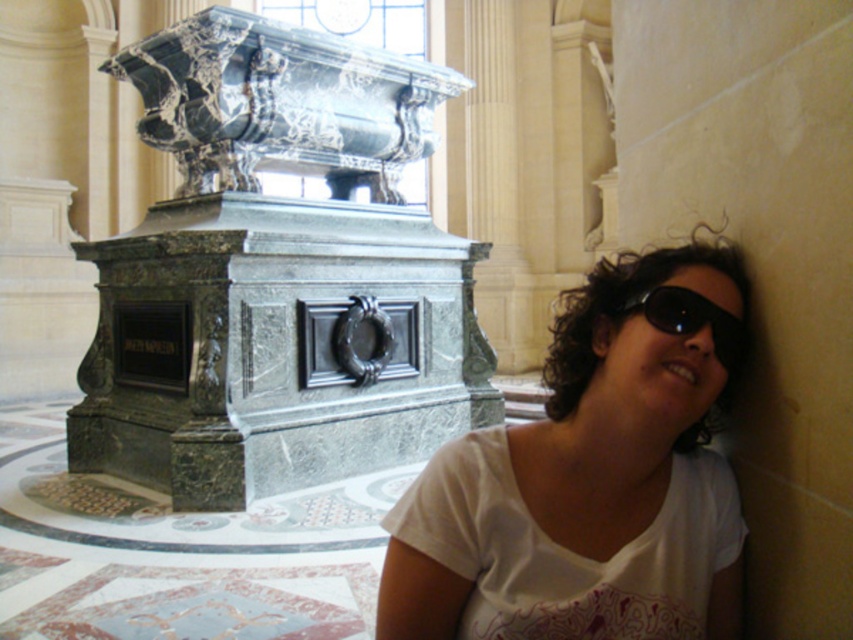
You are a photographer setting up for a shoot in this classical interior space. You have a white cotton shirt at lower right and black plastic goggles at lower right. Which item would you need to adjust your camera focus on if you want to capture the larger object clearly?

The white cotton shirt at lower right has a larger size compared to the black plastic goggles at lower right, so you should adjust the camera focus on the white cotton shirt at lower right to capture the larger object clearly.